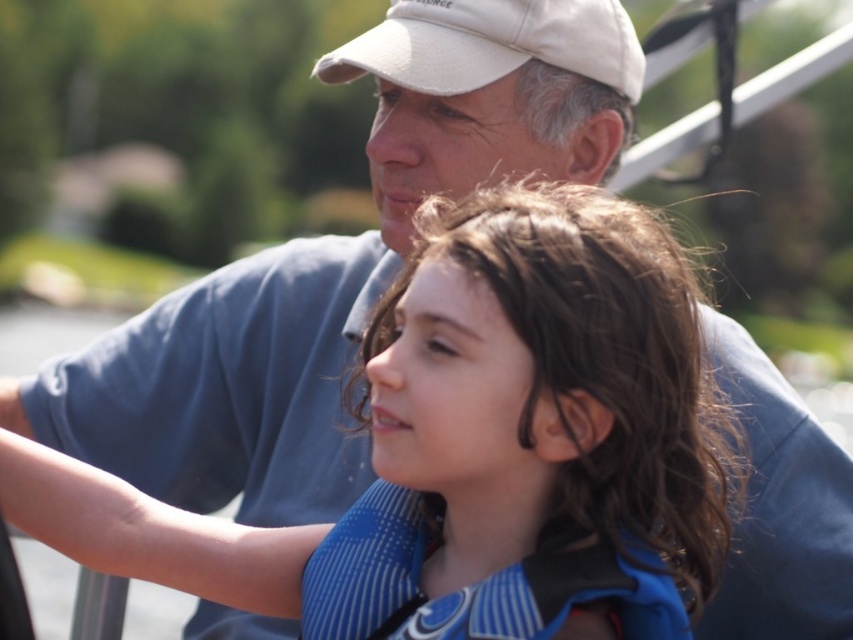
This screenshot has height=640, width=853. Find the location of `wet hair at center`. wet hair at center is located at coordinates (532, 429).

Which is in front, point (373, 408) or point (520, 20)?

Point (373, 408)

This screenshot has width=853, height=640. Identify the location of wet hair at center. (532, 429).